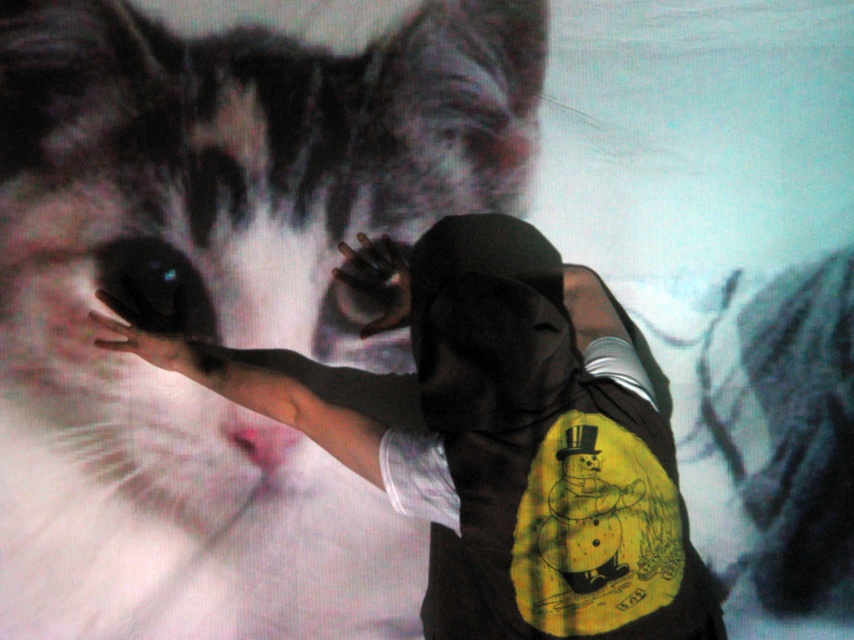
You are a security camera observing the scene. You notice the gray textured fur at upper right and the black matte glove at center. Which object is closer to the camera?

The gray textured fur at upper right is closer to the camera because the black matte glove at center is behind it.

You are a robotic arm that needs to touch the gray textured fur at upper right and the black matte glove at center. What is the minimum distance you need to move between them?

The minimum distance between the gray textured fur at upper right and the black matte glove at center is 30.91 inches, so the robotic arm needs to move at least that distance.

You are a character in a video game and need to position your character exactly at the center of the white fur cat at center. What coordinates should you input into the game to achieve this?

The coordinates to position your character exactly at the center of the white fur cat at center are 0.472 on the x axis and 0.256 on the y axis.